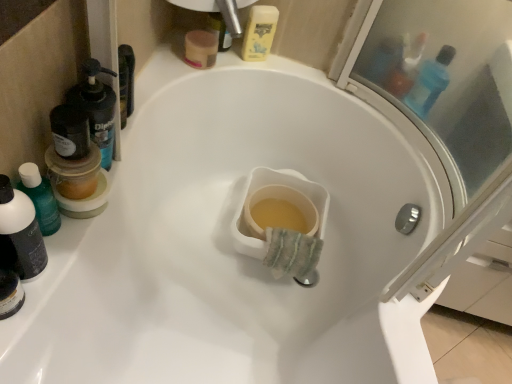
Question: Is blue translucent bottle at upper right, which is counted as the 3th mouthwash, starting from the bottom, positioned far away from translucent plastic mouthwash at left, the fourth mouthwash when ordered from back to front?

Choices:
 (A) no
 (B) yes

Answer: (A)

Question: Is blue translucent bottle at upper right, which is counted as the 1th mouthwash, starting from the right, positioned beyond the bounds of translucent plastic mouthwash at left, the fourth mouthwash when ordered from back to front?

Choices:
 (A) yes
 (B) no

Answer: (A)

Question: Does blue translucent bottle at upper right, which appears as the fourth mouthwash when viewed from the left, appear on the right side of translucent plastic mouthwash at left, the fourth mouthwash viewed from the right?

Choices:
 (A) no
 (B) yes

Answer: (B)

Question: Can you confirm if blue translucent bottle at upper right, which ranks as the 2th mouthwash in back-to-front order, is wider than translucent plastic mouthwash at left, which is the fourth mouthwash in top-to-bottom order?

Choices:
 (A) no
 (B) yes

Answer: (B)

Question: Is blue translucent bottle at upper right, which appears as the fourth mouthwash when viewed from the left, taller than translucent plastic mouthwash at left, the first mouthwash positioned from the front?

Choices:
 (A) no
 (B) yes

Answer: (A)

Question: Considering the positions of translucent plastic mouthwash at left, which appears as the first mouthwash when viewed from the left, and black plastic mouthwash at left, the second mouthwash positioned from the left, in the image, is translucent plastic mouthwash at left, which appears as the first mouthwash when viewed from the left, bigger or smaller than black plastic mouthwash at left, the second mouthwash positioned from the left,?

Choices:
 (A) big
 (B) small

Answer: (B)

Question: Based on their positions, is translucent plastic mouthwash at left, acting as the 1th mouthwash starting from the bottom, located to the left or right of black plastic mouthwash at left, the 3th mouthwash when ordered from top to bottom?

Choices:
 (A) left
 (B) right

Answer: (A)

Question: Is translucent plastic mouthwash at left, the fourth mouthwash viewed from the right, inside or outside of black plastic mouthwash at left, which is the 3th mouthwash in back-to-front order?

Choices:
 (A) outside
 (B) inside

Answer: (A)

Question: Is translucent plastic mouthwash at left, acting as the 1th mouthwash starting from the bottom, wider or thinner than black plastic mouthwash at left, which is the 3th mouthwash in back-to-front order?

Choices:
 (A) thin
 (B) wide

Answer: (A)

Question: From a real-world perspective, relative to blue translucent bottle at upper right, which is counted as the 3th mouthwash, starting from the bottom, is yellow plastic mouthwash at upper center, which is the first mouthwash in top-to-bottom order, vertically above or below?

Choices:
 (A) above
 (B) below

Answer: (B)

Question: In terms of height, does yellow plastic mouthwash at upper center, which is the first mouthwash in top-to-bottom order, look taller or shorter compared to blue translucent bottle at upper right, the 3th mouthwash positioned from the front?

Choices:
 (A) tall
 (B) short

Answer: (B)

Question: Would you say yellow plastic mouthwash at upper center, which ranks as the 3th mouthwash in left-to-right order, is inside or outside blue translucent bottle at upper right, which ranks as the 2th mouthwash in back-to-front order?

Choices:
 (A) outside
 (B) inside

Answer: (A)

Question: Considering the positions of yellow plastic mouthwash at upper center, which is the fourth mouthwash in front-to-back order, and blue translucent bottle at upper right, which ranks as the 2th mouthwash in back-to-front order, in the image, is yellow plastic mouthwash at upper center, which is the fourth mouthwash in front-to-back order, wider or thinner than blue translucent bottle at upper right, which ranks as the 2th mouthwash in back-to-front order,?

Choices:
 (A) thin
 (B) wide

Answer: (A)

Question: In the image, is blue translucent bottle at upper right, which is counted as the 1th mouthwash, starting from the right, positioned in front of or behind translucent plastic mouthwash at left, which is the fourth mouthwash in top-to-bottom order?

Choices:
 (A) front
 (B) behind

Answer: (B)

Question: From a real-world perspective, is blue translucent bottle at upper right, which is counted as the 1th mouthwash, starting from the right, positioned above or below translucent plastic mouthwash at left, which is the fourth mouthwash in top-to-bottom order?

Choices:
 (A) above
 (B) below

Answer: (B)